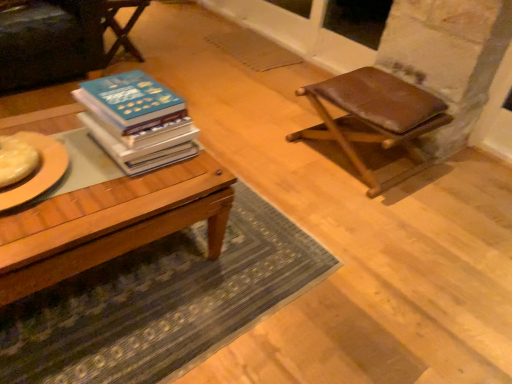
Question: Looking at their shapes, would you say brown leather stool at right is wider or thinner than wooden chair at upper left?

Choices:
 (A) thin
 (B) wide

Answer: (B)

Question: Is brown leather stool at right situated inside wooden chair at upper left or outside?

Choices:
 (A) outside
 (B) inside

Answer: (A)

Question: Based on their relative distances, which object is farther from the brown leather stool at right?

Choices:
 (A) wooden table at center
 (B) hardcover books at center
 (C) green textured rug at lower center
 (D) wooden chair at upper left

Answer: (D)

Question: Estimate the real-world distances between objects in this image. Which object is closer to the green textured rug at lower center?

Choices:
 (A) wooden table at center
 (B) hardcover books at center
 (C) brown leather stool at right
 (D) wooden chair at upper left

Answer: (A)